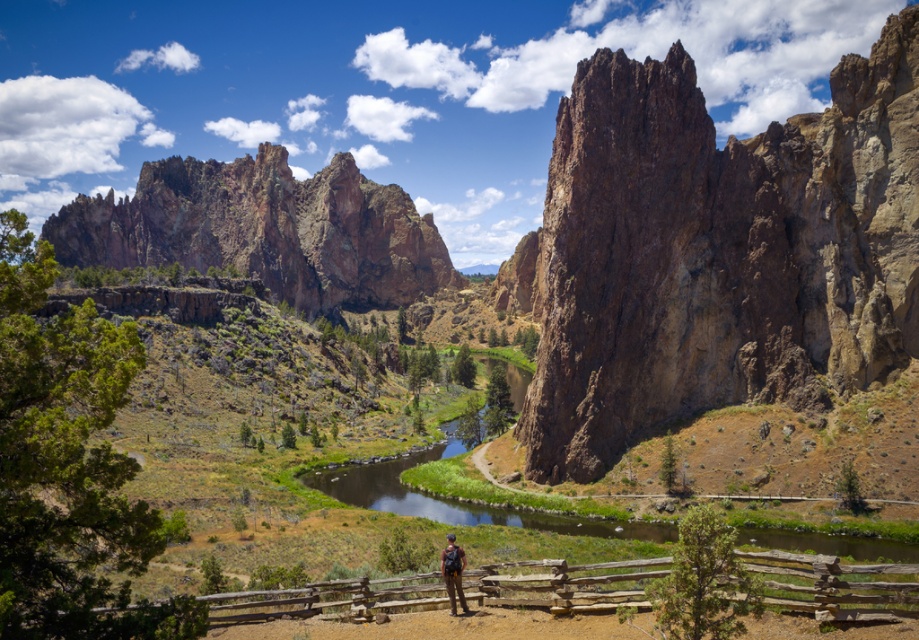
Is rustic rock formation at upper left shorter than brown wooden fence at lower center?

In fact, rustic rock formation at upper left may be taller than brown wooden fence at lower center.

Can you confirm if rustic rock formation at upper left is wider than brown wooden fence at lower center?

Yes, rustic rock formation at upper left is wider than brown wooden fence at lower center.

Between point (339, 209) and point (563, 582), which one is positioned behind?

Positioned behind is point (339, 209).

The width and height of the screenshot is (919, 640). I want to click on rustic rock formation at upper left, so point(265,228).

Between brown wooden fence at lower center and brown leather backpack at center, which one appears on the right side from the viewer's perspective?

From the viewer's perspective, brown wooden fence at lower center appears more on the right side.

Does brown wooden fence at lower center have a greater width compared to brown leather backpack at center?

Yes.

Is point (813, 572) positioned after point (454, 570)?

No, (813, 572) is in front of (454, 570).

Locate an element on the screen. This screenshot has width=919, height=640. brown wooden fence at lower center is located at coordinates (825, 586).

Is rustic brown rock at center bigger than rustic rock formation at upper left?

No, rustic brown rock at center is not bigger than rustic rock formation at upper left.

Is point (912, 339) closer to viewer compared to point (370, 275)?

Yes, it is.

At what (x,y) coordinates should I click in order to perform the action: click on rustic brown rock at center. Please return your answer as a coordinate pair (x, y). Looking at the image, I should click on (719, 252).